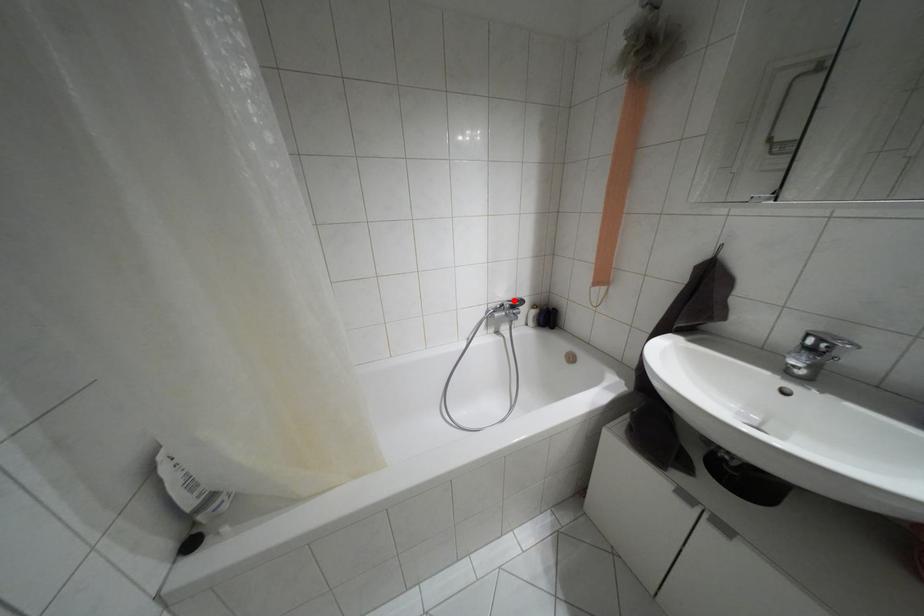
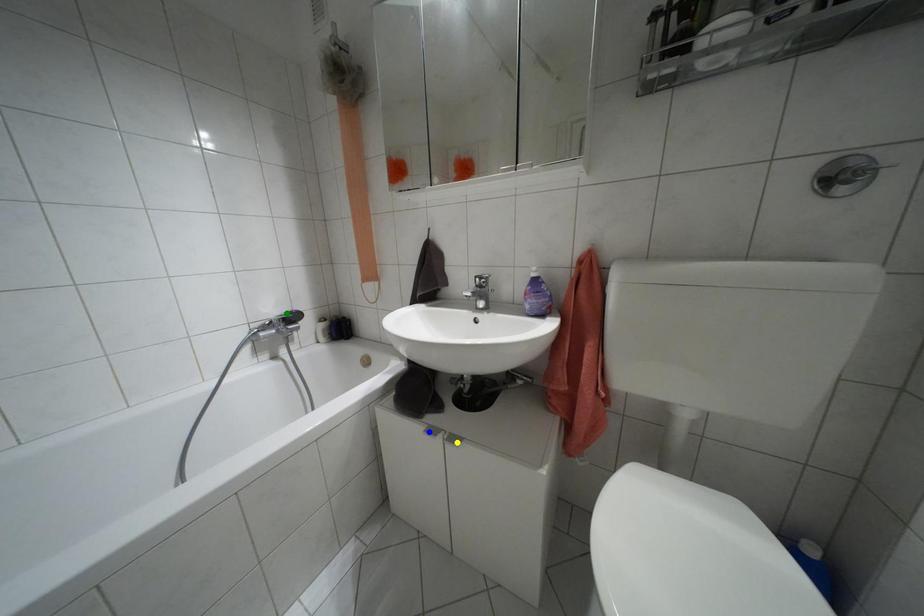
Question: I am providing you with two images of the same scene from different viewpoints. A red point is marked on the first image. You are given multiple points on the second image. Which mark in image 2 goes with the point in image 1?

Choices:
 (A) yellow point
 (B) blue point
 (C) green point

Answer: (C)